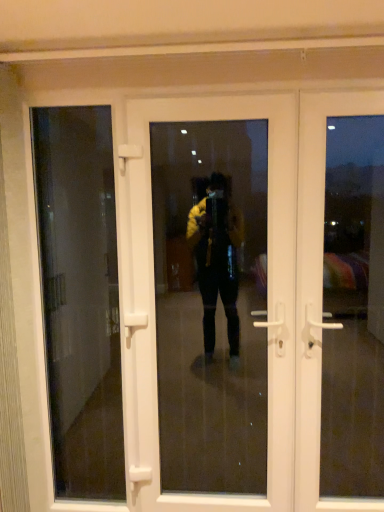
Question: Considering the positions of white plastic door at right, the first door when ordered from right to left, and white plastic door at center, the 1th door in the left-to-right sequence, in the image, is white plastic door at right, the first door when ordered from right to left, wider or thinner than white plastic door at center, the 1th door in the left-to-right sequence,?

Choices:
 (A) thin
 (B) wide

Answer: (A)

Question: In terms of size, does white plastic door at right, the first door when ordered from right to left, appear bigger or smaller than white plastic door at center, the 2th door positioned from the right?

Choices:
 (A) big
 (B) small

Answer: (B)

Question: Which is farther from the transparent glass door at left?

Choices:
 (A) white plastic door at center, the 2th door positioned from the right
 (B) white plastic door at right, which is the second door from left to right

Answer: (B)

Question: Estimate the real-world distances between objects in this image. Which object is farther from the white plastic door at right, the first door when ordered from right to left?

Choices:
 (A) white plastic door at center, the 2th door positioned from the right
 (B) transparent glass door at left

Answer: (B)